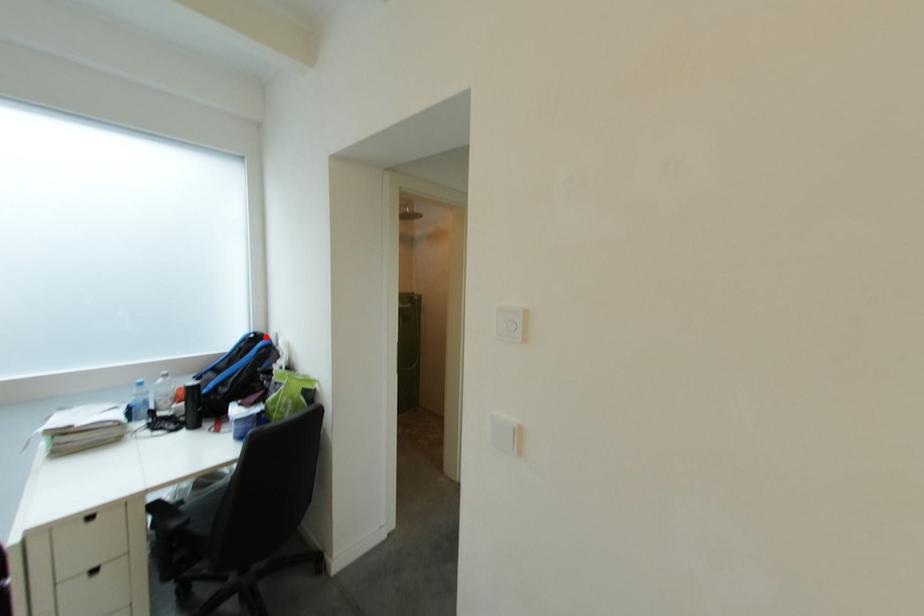
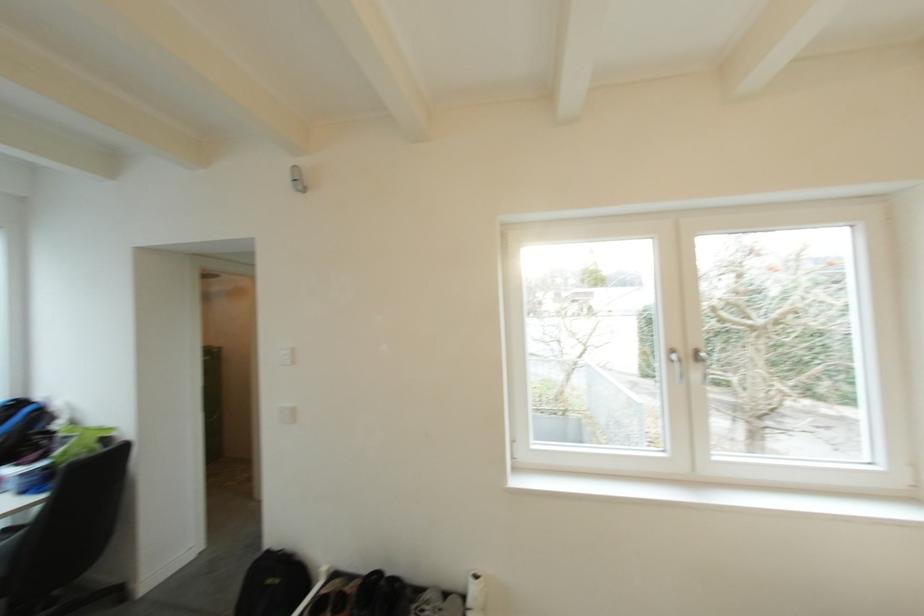
Find the pixel in the second image that matches the highlighted location in the first image.

(29, 403)